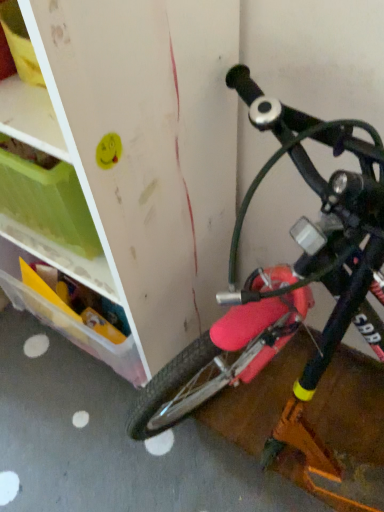
Question: From their relative heights in the image, would you say pink matte bicycle at right is taller or shorter than translucent plastic storage box at left?

Choices:
 (A) short
 (B) tall

Answer: (B)

Question: Is pink matte bicycle at right in front of or behind translucent plastic storage box at left in the image?

Choices:
 (A) front
 (B) behind

Answer: (A)

Question: From the image's perspective, relative to translucent plastic storage box at left, is pink matte bicycle at right above or below?

Choices:
 (A) above
 (B) below

Answer: (B)

Question: From the image's perspective, is translucent plastic storage box at left positioned above or below pink matte bicycle at right?

Choices:
 (A) above
 (B) below

Answer: (A)

Question: Considering the positions of point (26, 301) and point (251, 87), is point (26, 301) closer or farther from the camera than point (251, 87)?

Choices:
 (A) closer
 (B) farther

Answer: (B)

Question: Considering their positions, is translucent plastic storage box at left located in front of or behind pink matte bicycle at right?

Choices:
 (A) front
 (B) behind

Answer: (B)

Question: From a real-world perspective, is translucent plastic storage box at left physically located above or below pink matte bicycle at right?

Choices:
 (A) below
 (B) above

Answer: (A)